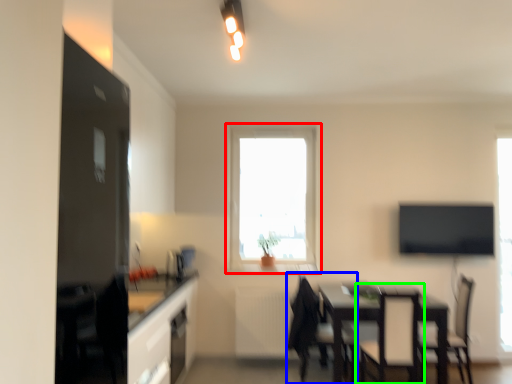
Question: Estimate the real-world distances between objects in this image. Which object is closer to window (highlighted by a red box), chair (highlighted by a blue box) or armchair (highlighted by a green box)?

Choices:
 (A) chair
 (B) armchair

Answer: (A)